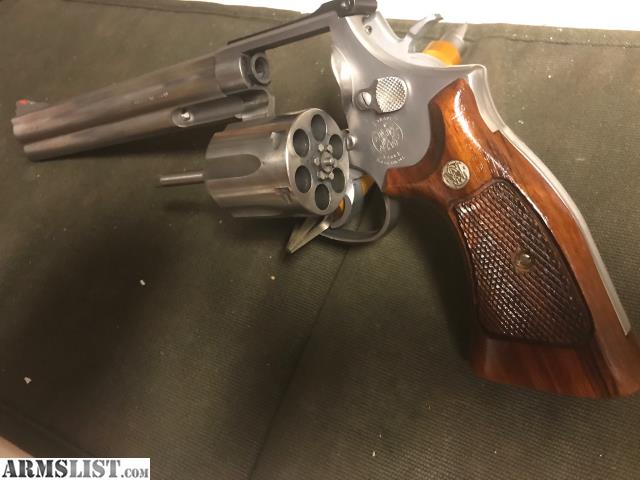
Where is `rod`? This screenshot has height=480, width=640. rod is located at coordinates point(187,173).